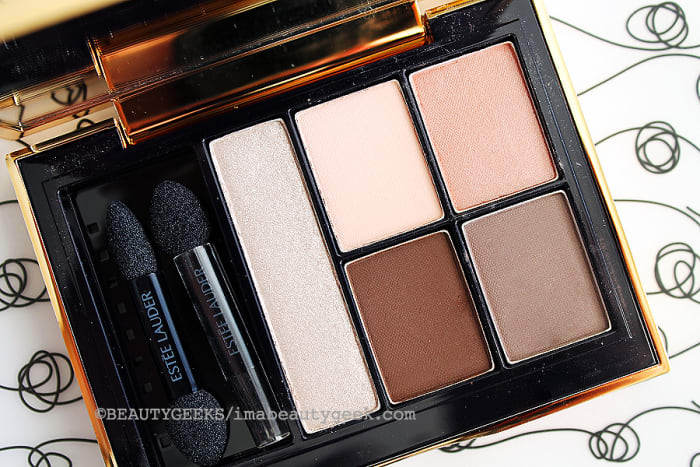
The width and height of the screenshot is (700, 467). Identify the location of pink makeup. (526, 151).